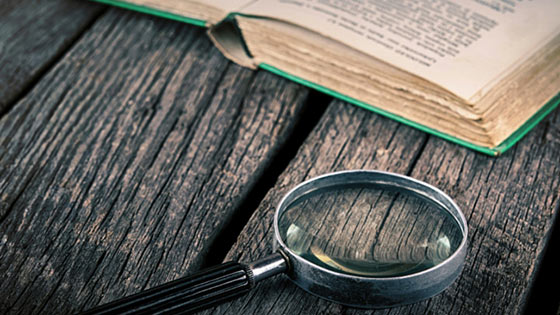
Locate an element on the screen. silver part of looking glass handle near the lens is located at coordinates (272, 264).